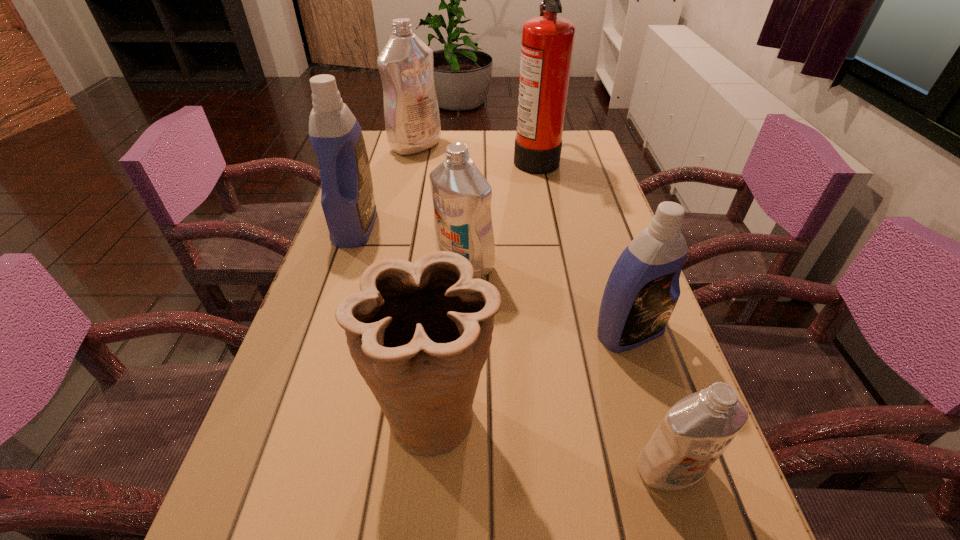
What are the coordinates of `empty space that is in between the smaller blue detergent and the farthest white detergent` in the screenshot? It's located at (522, 239).

At what (x,y) coordinates should I click in order to perform the action: click on vacant area between the farther blue detergent and the smallest white detergent. Please return your answer as a coordinate pair (x, y). Image resolution: width=960 pixels, height=540 pixels. Looking at the image, I should click on (513, 348).

Image resolution: width=960 pixels, height=540 pixels. Find the location of `free spot between the third nearest object and the farthest detergent`. free spot between the third nearest object and the farthest detergent is located at coordinates (522, 239).

Locate an element on the screen. The image size is (960, 540). free spot between the smallest white detergent and the urn is located at coordinates (552, 441).

What are the coordinates of `empty space that is in between the nearest white detergent and the farthest detergent` in the screenshot? It's located at (542, 307).

Identify the location of vacant space that is in between the nearest white detergent and the urn. (552, 441).

Locate an element on the screen. This screenshot has width=960, height=540. vacant point located between the farthest detergent and the shortest object is located at coordinates (542, 307).

Locate an element on the screen. vacant area that lies between the shortest object and the urn is located at coordinates (552, 441).

Identify the location of the closest object to the nearer blue detergent. The image size is (960, 540). (697, 429).

Point out which object is positioned as the third nearest to the rightmost white detergent. Please provide its 2D coordinates. Your answer should be formatted as a tuple, i.e. [(x, y)], where the tuple contains the x and y coordinates of a point satisfying the conditions above.

[(461, 195)]